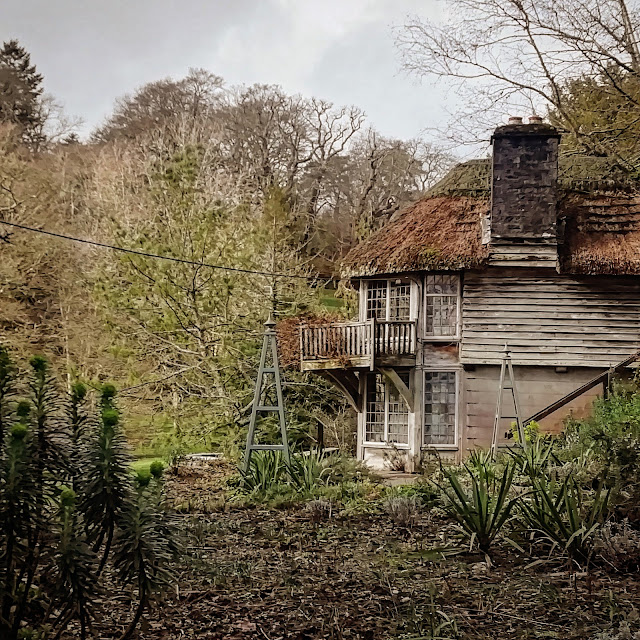
Find the location of a particular element. The width and height of the screenshot is (640, 640). black wire is located at coordinates (177, 259).